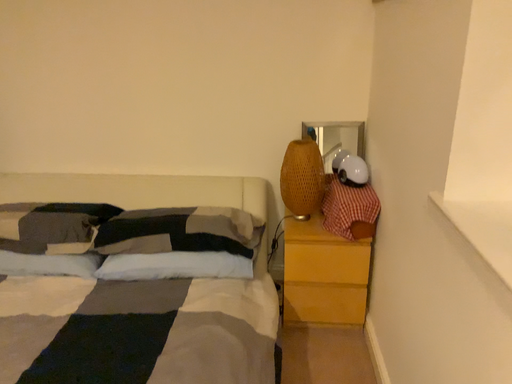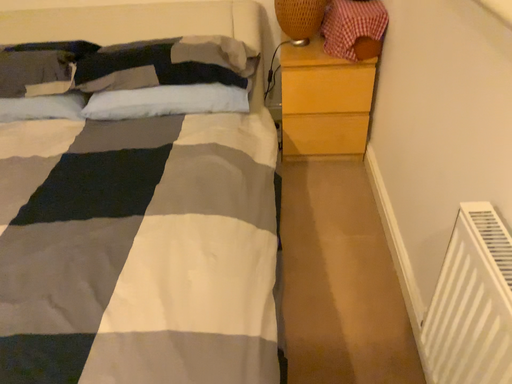
Question: Which way did the camera rotate in the video?

Choices:
 (A) rotated downward
 (B) rotated upward

Answer: (A)